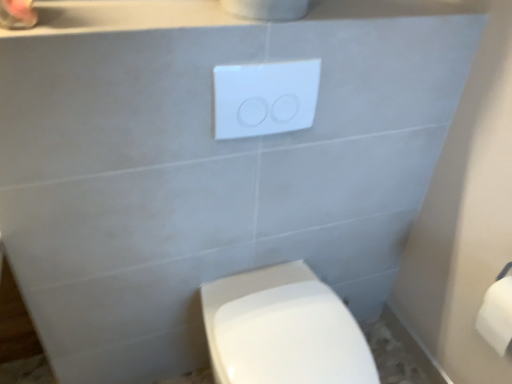
Question: Do you think white plastic/light switch at upper center is within white glossy toilet at lower center, or outside of it?

Choices:
 (A) outside
 (B) inside

Answer: (A)

Question: Considering the positions of point (278, 99) and point (289, 372), is point (278, 99) closer or farther from the camera than point (289, 372)?

Choices:
 (A) farther
 (B) closer

Answer: (B)

Question: Which is farther from the white glossy toilet at lower center?

Choices:
 (A) white matte toilet paper at right
 (B) white plastic/light switch at upper center

Answer: (B)

Question: Which object is positioned farthest from the white glossy toilet at lower center?

Choices:
 (A) white matte toilet paper at right
 (B) white plastic/light switch at upper center

Answer: (B)